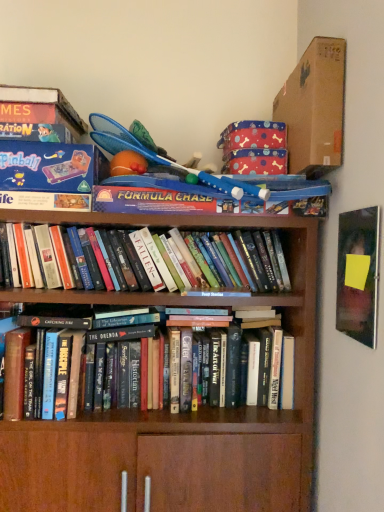
Question: From a real-world perspective, is blue plastic toy at upper center under matte black book at upper right?

Choices:
 (A) no
 (B) yes

Answer: (A)

Question: Is blue plastic toy at upper center shorter than matte black book at upper right?

Choices:
 (A) no
 (B) yes

Answer: (B)

Question: From a real-world perspective, is blue plastic toy at upper center located higher than matte black book at upper right?

Choices:
 (A) no
 (B) yes

Answer: (B)

Question: Does blue plastic toy at upper center have a smaller size compared to matte black book at upper right?

Choices:
 (A) yes
 (B) no

Answer: (B)

Question: Is matte black book at upper right at the back of blue plastic toy at upper center?

Choices:
 (A) no
 (B) yes

Answer: (A)

Question: Is blue plastic toy at upper center positioned beyond the bounds of matte black book at upper right?

Choices:
 (A) yes
 (B) no

Answer: (A)

Question: From the image's perspective, does hardcover books at center, placed as the 2th book when sorted from bottom to top, appear higher than hardcover books at center, which is the 2th book in top-to-bottom order?

Choices:
 (A) no
 (B) yes

Answer: (B)

Question: Can you confirm if hardcover books at center, which ranks as the 1th book in top-to-bottom order, is wider than hardcover books at center, which is the 2th book in top-to-bottom order?

Choices:
 (A) no
 (B) yes

Answer: (A)

Question: From the image's perspective, is hardcover books at center, which ranks as the 1th book in top-to-bottom order, beneath hardcover books at center, the 1th book ordered from the bottom?

Choices:
 (A) yes
 (B) no

Answer: (B)

Question: From a real-world perspective, is hardcover books at center, placed as the 2th book when sorted from bottom to top, positioned over hardcover books at center, the 1th book ordered from the bottom, based on gravity?

Choices:
 (A) yes
 (B) no

Answer: (A)

Question: Does hardcover books at center, placed as the 2th book when sorted from bottom to top, have a smaller size compared to hardcover books at center, which is the 2th book in top-to-bottom order?

Choices:
 (A) no
 (B) yes

Answer: (B)

Question: Is hardcover books at center, which ranks as the 1th book in top-to-bottom order, positioned behind hardcover books at center, which is the 2th book in top-to-bottom order?

Choices:
 (A) no
 (B) yes

Answer: (B)

Question: Is matte black book at upper right wider than blue plastic toy at upper center?

Choices:
 (A) yes
 (B) no

Answer: (B)